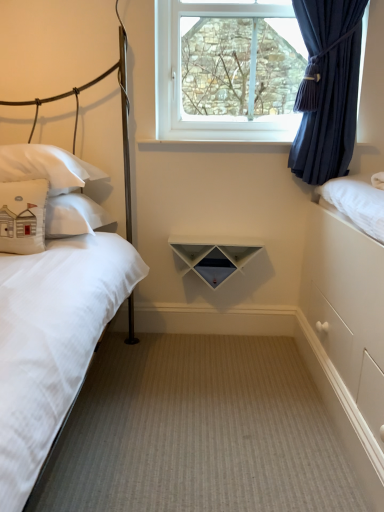
Question: Would you say beige fabric pillow at left, which is the first pillow in front-to-back order, contains white matte triangle at center?

Choices:
 (A) no
 (B) yes

Answer: (A)

Question: From the image's perspective, is beige fabric pillow at left, the second pillow positioned from the back, on white matte triangle at center?

Choices:
 (A) yes
 (B) no

Answer: (A)

Question: Is beige fabric pillow at left, which is the first pillow in front-to-back order, with white matte triangle at center?

Choices:
 (A) yes
 (B) no

Answer: (B)

Question: From a real-world perspective, is beige fabric pillow at left, the second pillow positioned from the back, below white matte triangle at center?

Choices:
 (A) yes
 (B) no

Answer: (B)

Question: Is beige fabric pillow at left, the second pillow positioned from the back, positioned far away from white matte triangle at center?

Choices:
 (A) yes
 (B) no

Answer: (B)

Question: From the image's perspective, is clear glass window at upper center located above or below white matte bed at left?

Choices:
 (A) below
 (B) above

Answer: (B)

Question: From their relative heights in the image, would you say clear glass window at upper center is taller or shorter than white matte bed at left?

Choices:
 (A) tall
 (B) short

Answer: (B)

Question: From a real-world perspective, relative to white matte bed at left, is clear glass window at upper center vertically above or below?

Choices:
 (A) below
 (B) above

Answer: (B)

Question: In the image, is clear glass window at upper center positioned in front of or behind white matte bed at left?

Choices:
 (A) front
 (B) behind

Answer: (B)

Question: Considering the positions of navy blue sheer curtain at upper right and beige fabric pillow at left, the second pillow positioned from the back, in the image, is navy blue sheer curtain at upper right bigger or smaller than beige fabric pillow at left, the second pillow positioned from the back,?

Choices:
 (A) small
 (B) big

Answer: (B)

Question: In the image, is navy blue sheer curtain at upper right positioned in front of or behind beige fabric pillow at left, which is the first pillow in front-to-back order?

Choices:
 (A) front
 (B) behind

Answer: (B)

Question: Considering the positions of point (336, 37) and point (14, 236), is point (336, 37) closer or farther from the camera than point (14, 236)?

Choices:
 (A) closer
 (B) farther

Answer: (B)

Question: From the image's perspective, is navy blue sheer curtain at upper right located above or below beige fabric pillow at left, the second pillow positioned from the back?

Choices:
 (A) above
 (B) below

Answer: (A)

Question: From their relative heights in the image, would you say beige fabric pillow at left, the second pillow positioned from the back, is taller or shorter than clear glass window at upper center?

Choices:
 (A) short
 (B) tall

Answer: (A)

Question: From the image's perspective, is beige fabric pillow at left, which is the first pillow in front-to-back order, positioned above or below clear glass window at upper center?

Choices:
 (A) above
 (B) below

Answer: (B)